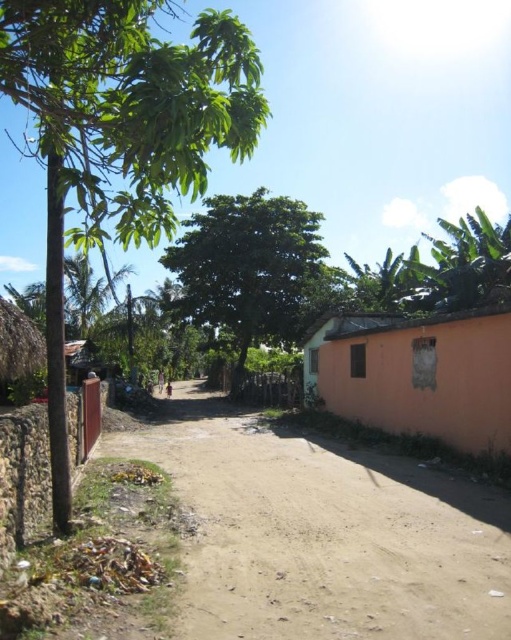
Is brown sandy dirt track at center thinner than orange matte wall at right?

Incorrect, brown sandy dirt track at center's width is not less than orange matte wall at right's.

Does brown sandy dirt track at center appear over orange matte wall at right?

Incorrect, brown sandy dirt track at center is not positioned above orange matte wall at right.

Consider the image. Who is more distant from viewer, (263, 624) or (508, 328)?

The point (508, 328) is behind.

At what (x,y) coordinates should I click in order to perform the action: click on brown sandy dirt track at center. Please return your answer as a coordinate pair (x, y). Looking at the image, I should click on (322, 534).

Is green leafy tree at left taller than green leafy tree at center?

Correct, green leafy tree at left is much taller as green leafy tree at center.

Where is `green leafy tree at left`? This screenshot has height=640, width=511. green leafy tree at left is located at coordinates coord(121,134).

Who is more forward, (254, 144) or (312, 316)?

Point (254, 144) is more forward.

Identify the location of green leafy tree at left. Image resolution: width=511 pixels, height=640 pixels. (121, 134).

Can you confirm if brown sandy dirt track at center is taller than green leafy tree at upper right?

Incorrect, brown sandy dirt track at center's height is not larger of green leafy tree at upper right's.

Between brown sandy dirt track at center and green leafy tree at upper right, which one is positioned lower?

brown sandy dirt track at center

Image resolution: width=511 pixels, height=640 pixels. What are the coordinates of `brown sandy dirt track at center` in the screenshot? It's located at (322, 534).